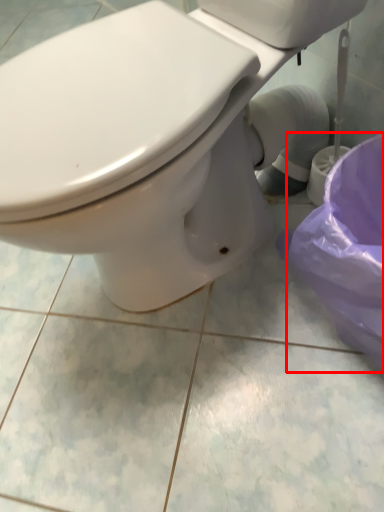
Question: From the image's perspective, considering the relative positions of potty (annotated by the red box) and toilet in the image provided, where is potty (annotated by the red box) located with respect to the staircase?

Choices:
 (A) below
 (B) above

Answer: (A)